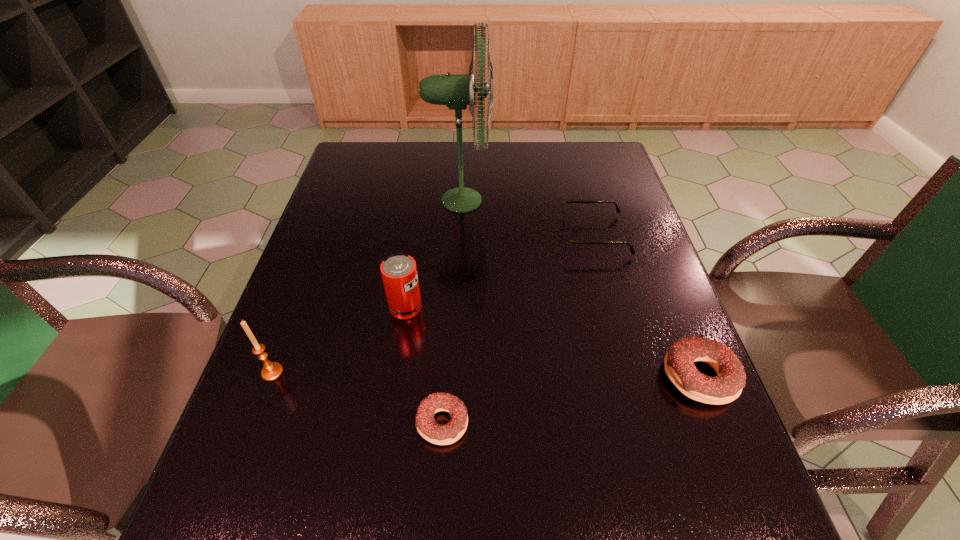
Identify the location of unoccupied area between the can and the spectacles. pyautogui.click(x=499, y=272).

Where is `vacant space that's between the shorter doughnut and the spectacles`? The width and height of the screenshot is (960, 540). vacant space that's between the shorter doughnut and the spectacles is located at coordinates (517, 329).

Locate an element on the screen. Image resolution: width=960 pixels, height=540 pixels. free space between the fourth nearest object and the tallest object is located at coordinates (433, 254).

Identify the location of vacant space that's between the shortest object and the leftmost object. The height and width of the screenshot is (540, 960). (357, 397).

You are a GUI agent. You are given a task and a screenshot of the screen. Output one action in this format:
    pyautogui.click(x=<x>, y=<y>)
    Task: Click on the free spot between the spectacles and the right doughnut
    
    Given the screenshot: What is the action you would take?
    pyautogui.click(x=646, y=306)

Identify the location of vacant space that is in between the leftmost object and the taller doughnut. (486, 374).

The image size is (960, 540). In order to click on vacant area that lies between the leftmost object and the fan in this screenshot , I will do `click(367, 286)`.

Point out which object is positioned as the fourth nearest to the shorter doughnut. Please provide its 2D coordinates. Your answer should be formatted as a tuple, i.e. [(x, y)], where the tuple contains the x and y coordinates of a point satisfying the conditions above.

[(569, 242)]

Identify which object is located as the second nearest to the shorter doughnut. Please provide its 2D coordinates. Your answer should be formatted as a tuple, i.e. [(x, y)], where the tuple contains the x and y coordinates of a point satisfying the conditions above.

[(271, 370)]

Identify the location of vacant space that satisfies the following two spatial constraints: 1. on the front-facing side of the fan; 2. on the front side of the third tallest object. The height and width of the screenshot is (540, 960). (455, 308).